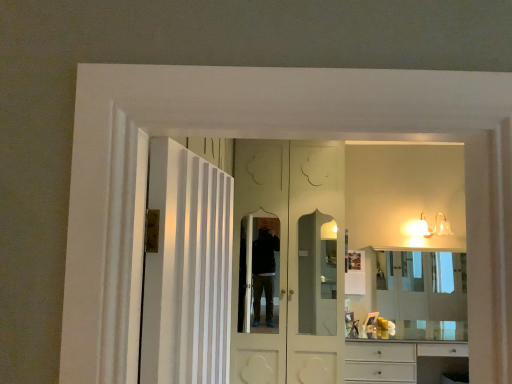
Question: Does white glossy cabinet at lower right have a lesser height compared to white glossy door at center, arranged as the second door when viewed from the back?

Choices:
 (A) no
 (B) yes

Answer: (B)

Question: Can you confirm if white glossy cabinet at lower right is smaller than white glossy door at center, marked as the first door in a front-to-back arrangement?

Choices:
 (A) no
 (B) yes

Answer: (A)

Question: From a real-world perspective, is white glossy cabinet at lower right physically below white glossy door at center, marked as the first door in a front-to-back arrangement?

Choices:
 (A) yes
 (B) no

Answer: (A)

Question: Is the depth of white glossy cabinet at lower right less than that of white glossy door at center, marked as the first door in a front-to-back arrangement?

Choices:
 (A) yes
 (B) no

Answer: (B)

Question: Can you confirm if white glossy cabinet at lower right is positioned to the left of white glossy door at center, marked as the first door in a front-to-back arrangement?

Choices:
 (A) yes
 (B) no

Answer: (B)

Question: From the image's perspective, is white glossy cabinet at lower right on top of white glossy door at center, arranged as the second door when viewed from the back?

Choices:
 (A) no
 (B) yes

Answer: (A)

Question: Does clear glass mirror at center have a larger size compared to white glossy wall sconce at upper right?

Choices:
 (A) no
 (B) yes

Answer: (B)

Question: Does clear glass mirror at center have a smaller size compared to white glossy wall sconce at upper right?

Choices:
 (A) yes
 (B) no

Answer: (B)

Question: Is white glossy wall sconce at upper right at the back of clear glass mirror at center?

Choices:
 (A) no
 (B) yes

Answer: (A)

Question: Does clear glass mirror at center touch white glossy wall sconce at upper right?

Choices:
 (A) no
 (B) yes

Answer: (A)

Question: From a real-world perspective, is clear glass mirror at center positioned under white glossy wall sconce at upper right based on gravity?

Choices:
 (A) yes
 (B) no

Answer: (A)

Question: From the image's perspective, would you say clear glass mirror at center is shown under white glossy wall sconce at upper right?

Choices:
 (A) yes
 (B) no

Answer: (A)

Question: Does white glossy cabinet at lower right have a smaller size compared to clear glass mirror at center?

Choices:
 (A) no
 (B) yes

Answer: (A)